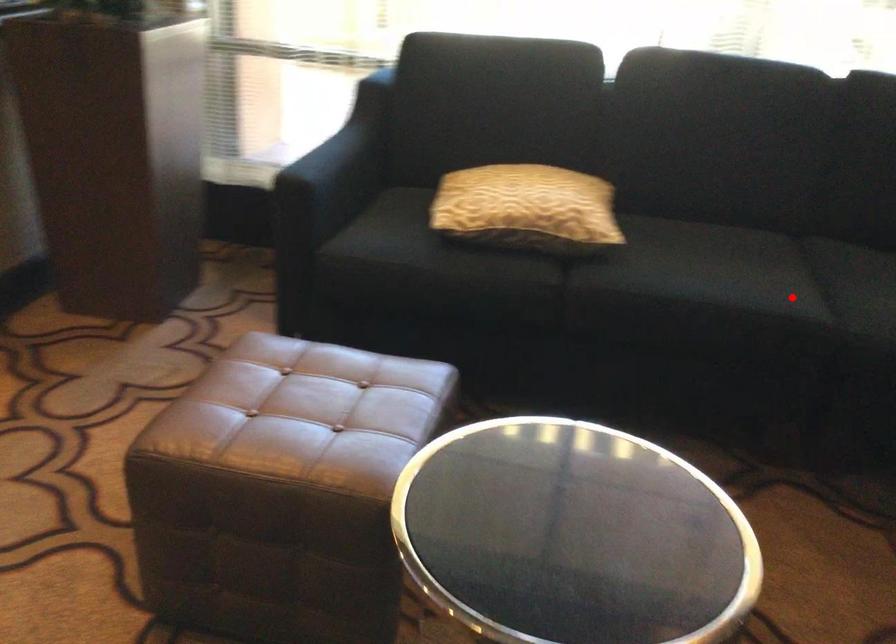
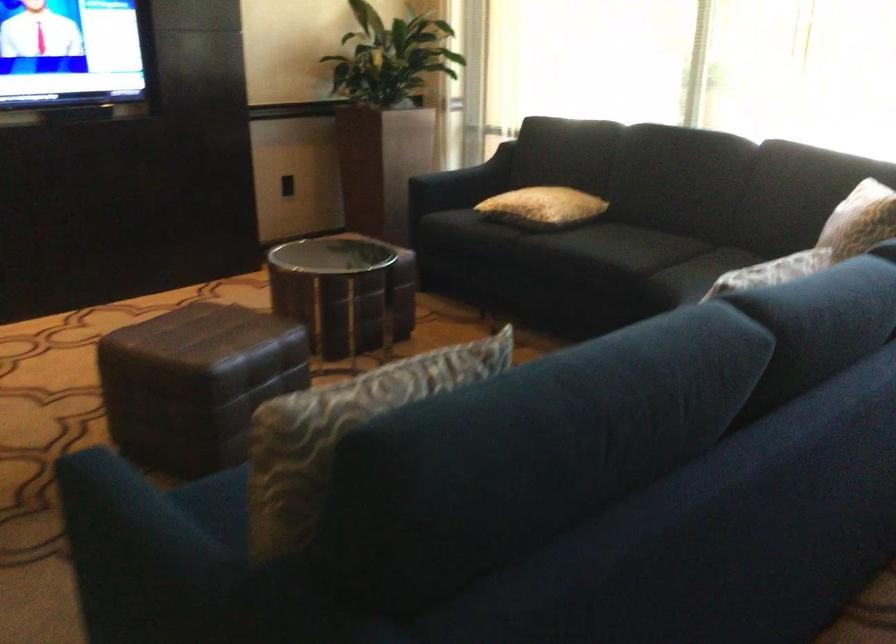
Question: I am providing you with two images of the same scene from different viewpoints. In image1, a red point is highlighted. Considering the same 3D point in image2, which of the following is correct?

Choices:
 (A) It is closer
 (B) It is farther

Answer: (B)